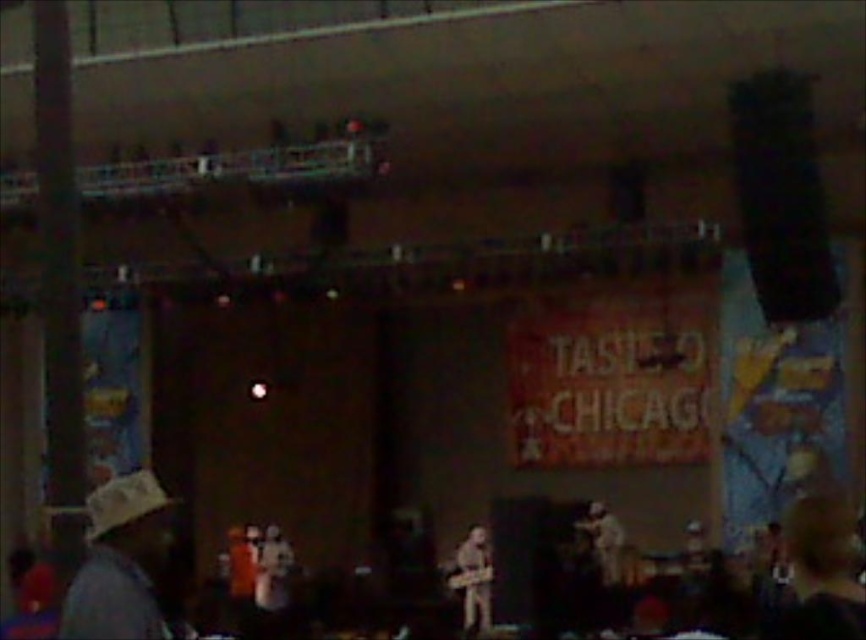
Question: Which object appears closest to the camera in this image?

Choices:
 (A) brown leather guitar at center
 (B) khaki fabric hat at lower left

Answer: (B)

Question: Which point is farther to the camera?

Choices:
 (A) brown leather guitar at center
 (B) khaki fabric hat at lower left

Answer: (A)

Question: Can you confirm if khaki fabric hat at lower left is positioned above brown leather guitar at center?

Choices:
 (A) yes
 (B) no

Answer: (A)

Question: Can you confirm if khaki fabric hat at lower left is bigger than brown leather guitar at center?

Choices:
 (A) yes
 (B) no

Answer: (B)

Question: Is the position of khaki fabric hat at lower left more distant than that of brown leather guitar at center?

Choices:
 (A) yes
 (B) no

Answer: (B)